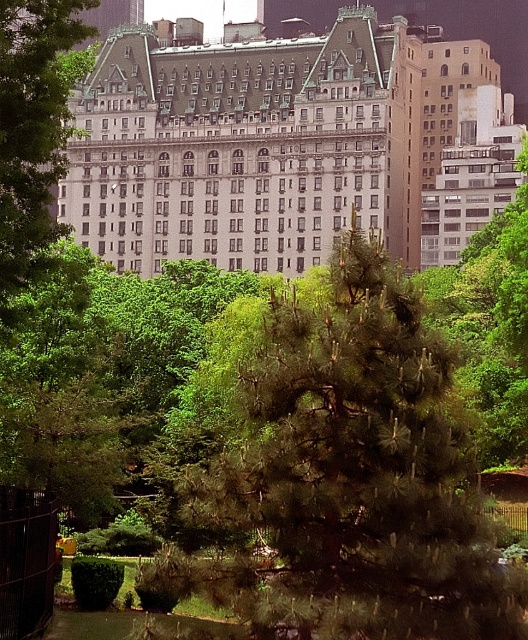
You are a city planner assessing the park layout. Given the dark green pine tree at center and the white stone building at center, which one is more likely to block sunlight to the surrounding plants?

The white stone building at center is larger in size compared to the dark green pine tree at center, so it is more likely to block sunlight to the surrounding plants.

You are standing in the park and see the white stone building at center and the green leafy tree at center. Which one is positioned more to the right side of the scene?

The white stone building at center is positioned more to the right side of the scene compared to the green leafy tree at center.

You are standing in the park and want to take a photo of both the white stone building at center and the green leafy tree at center. Which one should you zoom in on first to ensure both are in frame?

The white stone building at center is above the green leafy tree at center, so you should zoom in on the white stone building at center first to ensure both are in frame.